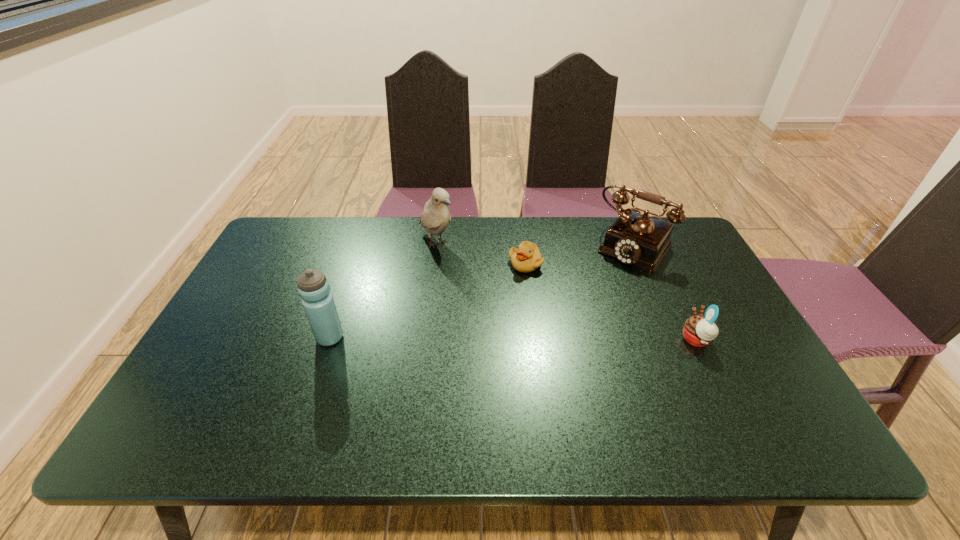
Locate an element on the screen. Image resolution: width=960 pixels, height=540 pixels. vacant space located 0.210m at the beak of the bird is located at coordinates (484, 296).

Locate an element on the screen. This screenshot has width=960, height=540. blank area located at the beak of the bird is located at coordinates (505, 317).

Where is `free location located 0.210m at the beak of the bird`? Image resolution: width=960 pixels, height=540 pixels. free location located 0.210m at the beak of the bird is located at coordinates (484, 296).

Locate an element on the screen. The width and height of the screenshot is (960, 540). vacant position located on the front-facing side of the duckling is located at coordinates (501, 309).

Find the location of a particular element. The height and width of the screenshot is (540, 960). vacant area located on the front-facing side of the duckling is located at coordinates (491, 329).

Locate an element on the screen. The height and width of the screenshot is (540, 960). free location located 0.220m on the front-facing side of the duckling is located at coordinates (493, 324).

I want to click on free space located 0.370m on the dial of the telephone, so click(561, 343).

The width and height of the screenshot is (960, 540). What are the coordinates of `vacant space located 0.250m on the dial of the telephone` in the screenshot? It's located at (583, 315).

Locate an element on the screen. The height and width of the screenshot is (540, 960). vacant space located on the dial of the telephone is located at coordinates (559, 346).

The width and height of the screenshot is (960, 540). Identify the location of bird present at the far edge. (435, 218).